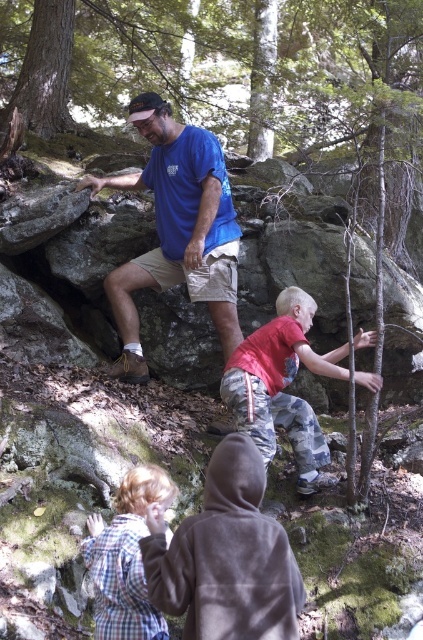
Is blue t-shirt at upper center wider than camouflage pants at center?

Correct, the width of blue t-shirt at upper center exceeds that of camouflage pants at center.

Looking at this image, which is more to the left, blue t-shirt at upper center or camouflage pants at center?

From the viewer's perspective, blue t-shirt at upper center appears more on the left side.

Locate an element on the screen. The image size is (423, 640). blue t-shirt at upper center is located at coordinates (176, 228).

Is blue t-shirt at upper center in front of plaid fabric shirt at lower left?

No.

Which is behind, point (140, 115) or point (126, 589)?

The point (140, 115) is behind.

You are a GUI agent. You are given a task and a screenshot of the screen. Output one action in this format:
    pyautogui.click(x=<x>, y=<y>)
    Task: Click on the blue t-shirt at upper center
    The height and width of the screenshot is (640, 423).
    Given the screenshot: What is the action you would take?
    pyautogui.click(x=176, y=228)

Is camouflage pants at center thinner than plaid fabric shirt at lower left?

Incorrect, camouflage pants at center's width is not less than plaid fabric shirt at lower left's.

Does point (315, 436) lie behind point (109, 600)?

Yes, it is.

Is point (250, 371) positioned after point (107, 579)?

Yes, it is.

In order to click on camouflage pants at center in this screenshot , I will do `click(280, 385)`.